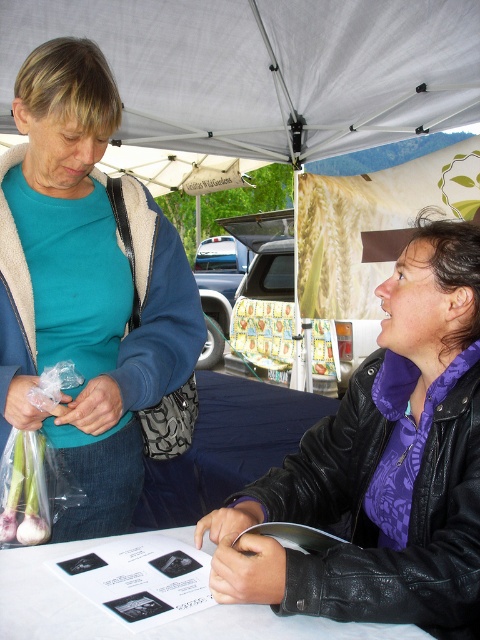
What do you see at coordinates (91, 292) in the screenshot? I see `matte teal shirt at left` at bounding box center [91, 292].

Is matte teal shirt at left further to camera compared to white fabric canopy at upper center?

No, matte teal shirt at left is in front of white fabric canopy at upper center.

In order to click on matte teal shirt at left in this screenshot , I will do `click(91, 292)`.

Does matte teal shirt at left appear under purple leather jacket at center?

Incorrect, matte teal shirt at left is not positioned below purple leather jacket at center.

Does point (31, 248) come behind point (443, 545)?

Yes, point (31, 248) is farther from viewer.

I want to click on matte teal shirt at left, so click(x=91, y=292).

Between purple leather jacket at center and white fabric canopy at upper center, which one has less height?

With less height is white fabric canopy at upper center.

Who is lower down, purple leather jacket at center or white fabric canopy at upper center?

Positioned lower is purple leather jacket at center.

Is point (411, 541) in front of point (374, 102)?

Yes, it is in front of point (374, 102).

The height and width of the screenshot is (640, 480). Find the location of `purple leather jacket at center`. purple leather jacket at center is located at coordinates (384, 467).